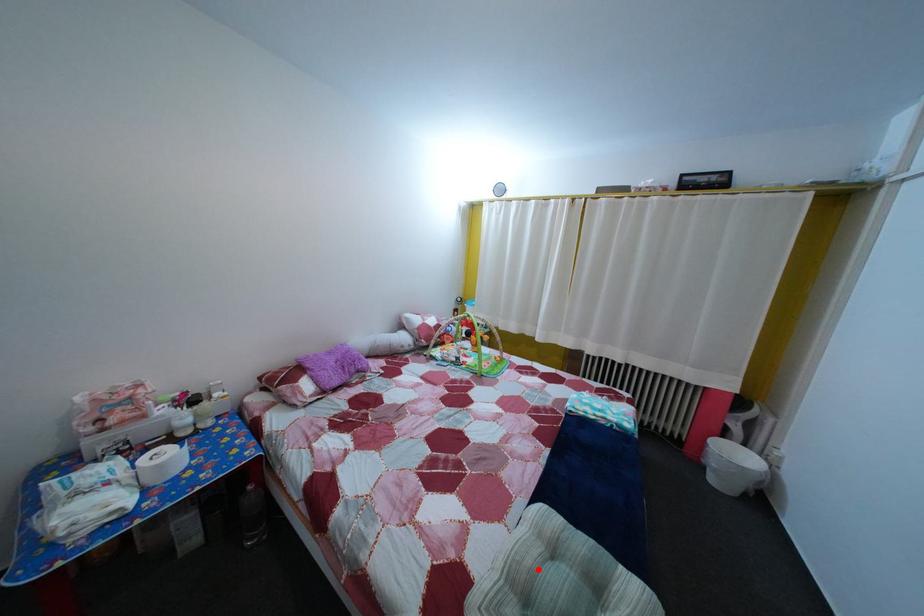
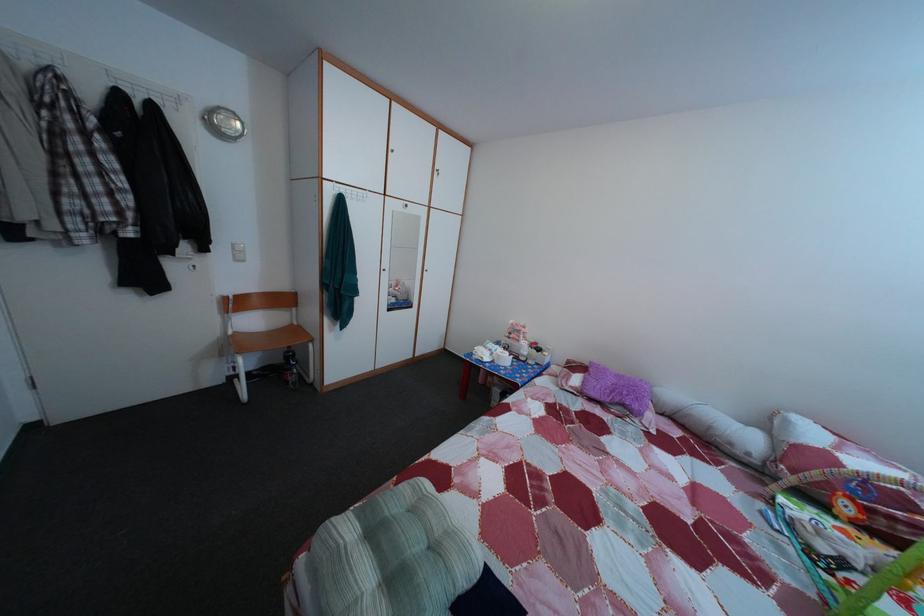
Question: A red point is marked in image1. In image2, is the corresponding 3D point closer to the camera or farther? Reply with the corresponding letter.

Choices:
 (A) The corresponding 3D point is closer.
 (B) The corresponding 3D point is farther.

Answer: (A)